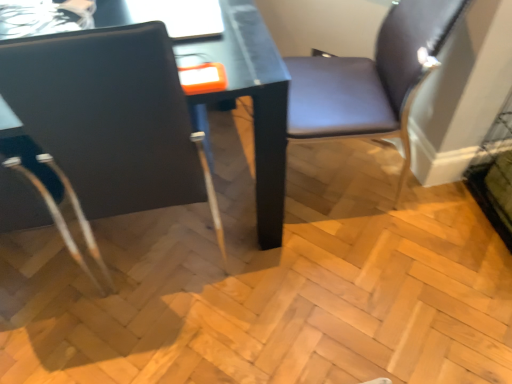
Find the location of a particular element. The height and width of the screenshot is (384, 512). vacant space to the right of purple leather chair at right, the first chair positioned from the right is located at coordinates (440, 206).